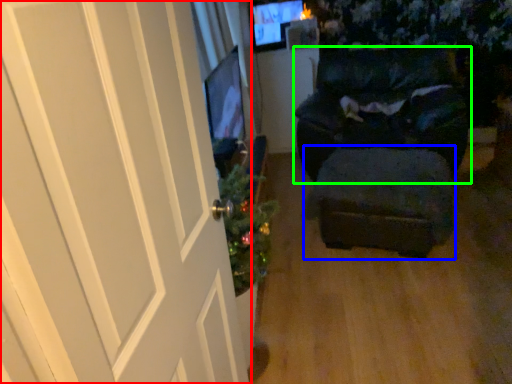
Question: Which object is positioned closest to door (highlighted by a red box)? Select from stool (highlighted by a blue box) and furniture (highlighted by a green box).

Choices:
 (A) stool
 (B) furniture

Answer: (A)